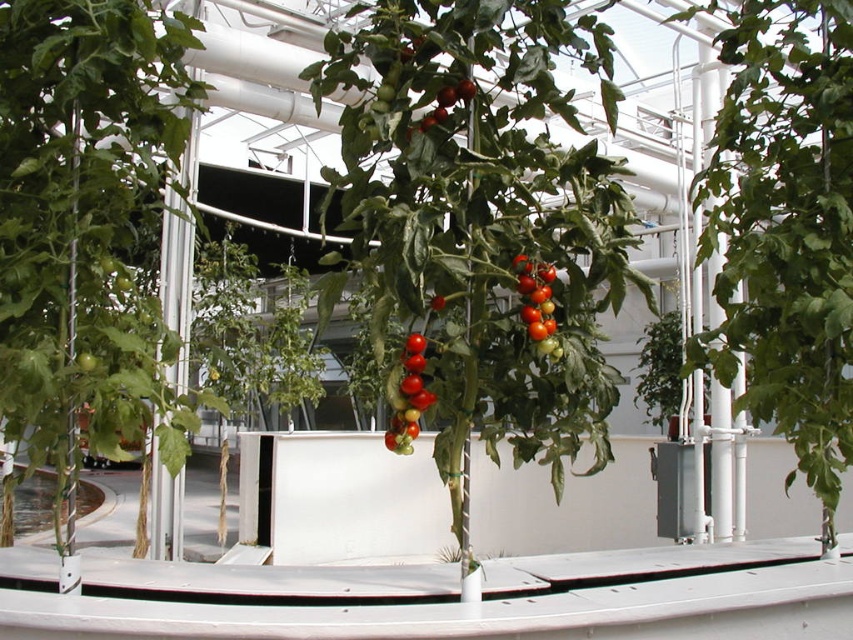
Question: Which object is the closest to the shiny red tomato at center?

Choices:
 (A) green matte plant at left
 (B) green matte plant at center
 (C) glossy red tomatoes at center
 (D) green matte leafy plant at center

Answer: (C)

Question: Is green matte leafy plant at center further to camera compared to glossy red tomatoes at center?

Choices:
 (A) yes
 (B) no

Answer: (A)

Question: Based on their relative distances, which object is nearer to the green matte plant at center?

Choices:
 (A) shiny red tomato at center
 (B) green matte plant at left
 (C) glossy red tomatoes at center
 (D) green matte leafy plant at center

Answer: (D)

Question: Is green matte plant at left above green matte plant at center?

Choices:
 (A) yes
 (B) no

Answer: (A)

Question: Which point is closer to the camera taking this photo?

Choices:
 (A) (51, 371)
 (B) (677, 356)

Answer: (A)

Question: Does green matte plant at center have a smaller size compared to glossy red tomatoes at center?

Choices:
 (A) no
 (B) yes

Answer: (A)